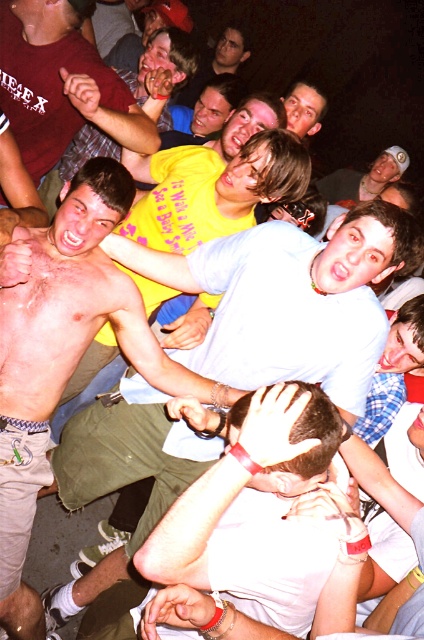
Which is more to the left, white matte shirt at center or matte yellow shirt at upper left?

From the viewer's perspective, matte yellow shirt at upper left appears more on the left side.

What do you see at coordinates (220, 492) in the screenshot?
I see `white matte shirt at center` at bounding box center [220, 492].

Which is behind, point (251, 403) or point (11, 84)?

The point (11, 84) is more distant.

This screenshot has width=424, height=640. I want to click on white matte shirt at center, so click(220, 492).

Which is in front, point (226, 504) or point (209, 61)?

Point (226, 504) is more forward.

Is white matte shirt at center positioned at the back of matte yellow t-shirt at center?

No, it is not.

Which is behind, point (178, 502) or point (231, 28)?

The point (231, 28) is behind.

Where is `white matte shirt at center`? The width and height of the screenshot is (424, 640). white matte shirt at center is located at coordinates (220, 492).

Between matte yellow shirt at upper left and matte yellow t-shirt at center, which one appears on the left side from the viewer's perspective?

Positioned to the left is matte yellow shirt at upper left.

Can you confirm if matte yellow shirt at upper left is taller than matte yellow t-shirt at center?

In fact, matte yellow shirt at upper left may be shorter than matte yellow t-shirt at center.

Is point (19, 84) farther from viewer compared to point (242, 32)?

No, (19, 84) is in front of (242, 32).

Find the location of `matte yellow shirt at upper left`. matte yellow shirt at upper left is located at coordinates (58, 84).